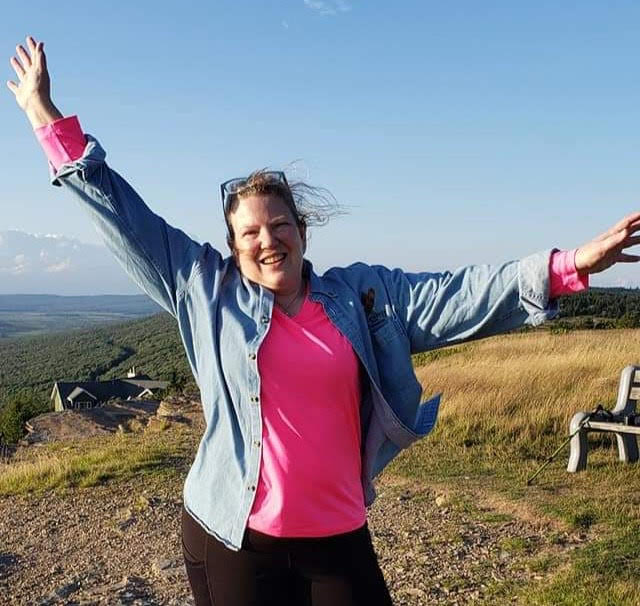
Where is `bench`? Image resolution: width=640 pixels, height=606 pixels. bench is located at coordinates (616, 435).